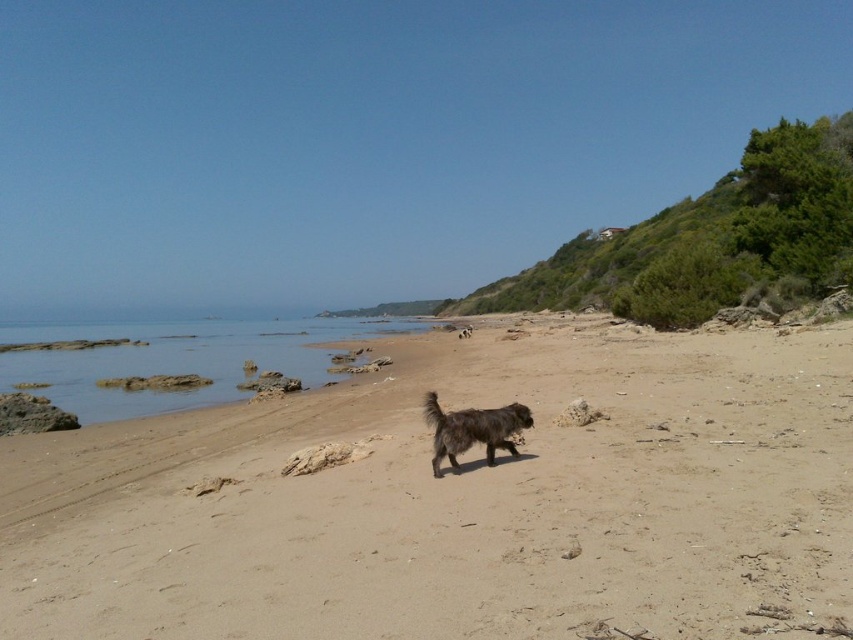
Between brown sandy beach at center and fuzzy brown dog at center, which one has more height?

brown sandy beach at center

Is brown sandy beach at center to the right of fuzzy brown dog at center from the viewer's perspective?

Yes, brown sandy beach at center is to the right of fuzzy brown dog at center.

I want to click on brown sandy beach at center, so click(x=459, y=500).

Based on the photo, between clear water at lower left and fuzzy brown dog at center, which one appears on the right side from the viewer's perspective?

fuzzy brown dog at center is more to the right.

Does clear water at lower left appear on the right side of fuzzy brown dog at center?

No, clear water at lower left is not to the right of fuzzy brown dog at center.

Between point (263, 369) and point (438, 458), which one is positioned behind?

The point (263, 369) is more distant.

This screenshot has width=853, height=640. Find the location of `clear water at lower left`. clear water at lower left is located at coordinates (177, 356).

Is brown sandy beach at center to the left of clear water at lower left from the viewer's perspective?

No, brown sandy beach at center is not to the left of clear water at lower left.

Can you confirm if brown sandy beach at center is positioned above clear water at lower left?

Incorrect, brown sandy beach at center is not positioned above clear water at lower left.

Measure the distance between brown sandy beach at center and camera.

brown sandy beach at center is 4.30 meters away from camera.

I want to click on brown sandy beach at center, so click(x=459, y=500).